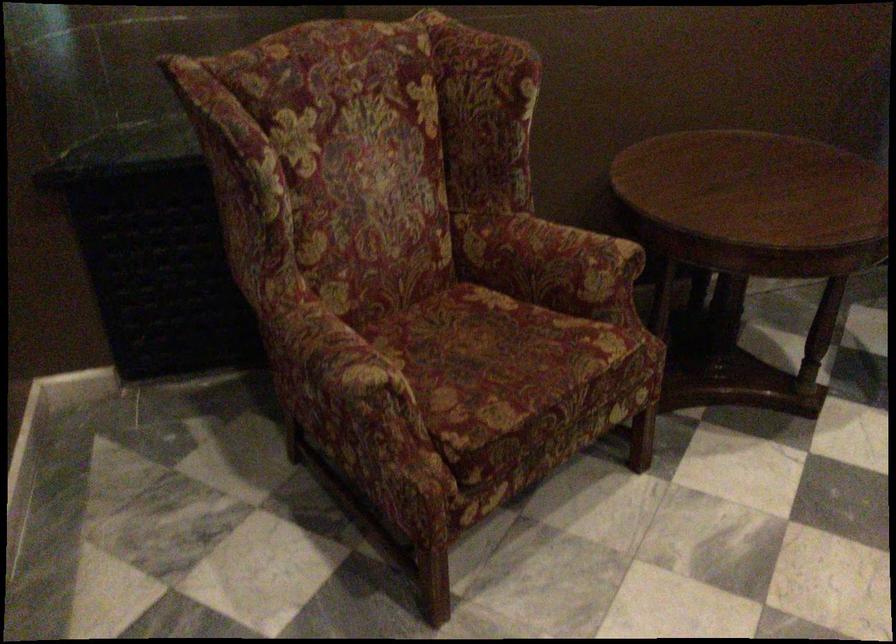
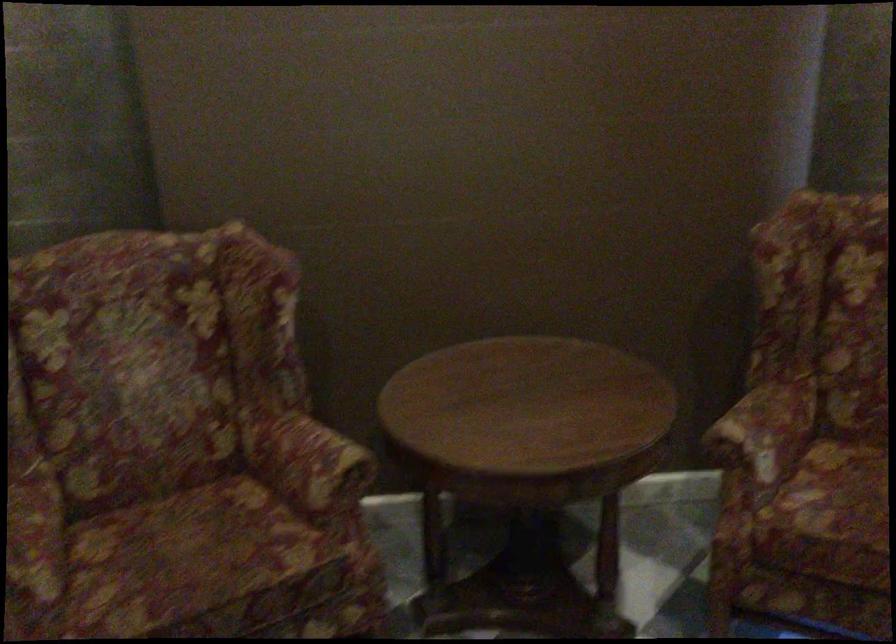
Question: The camera is either moving clockwise (left) or counter-clockwise (right) around the object. The first image is from the beginning of the video and the second image is from the end. Is the camera moving left or right when shooting the video?

Choices:
 (A) Left
 (B) Right

Answer: (B)